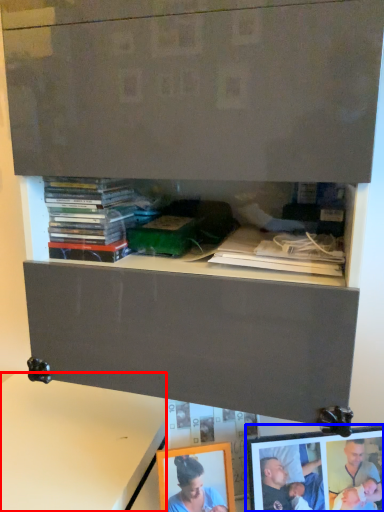
Question: Which point is further to the camera, table (highlighted by a red box) or picture frame (highlighted by a blue box)?

Choices:
 (A) table
 (B) picture frame

Answer: (A)